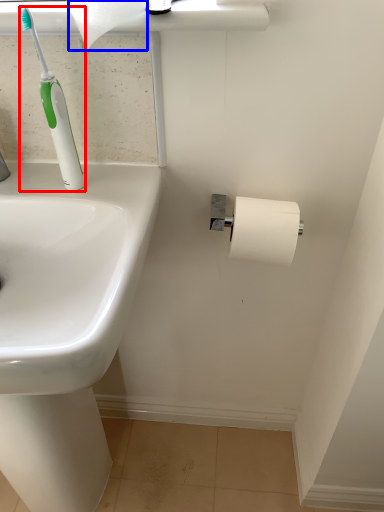
Question: Which of the following is the closest to the observer, toilet brush (highlighted by a red box) or toilet paper (highlighted by a blue box)?

Choices:
 (A) toilet brush
 (B) toilet paper

Answer: (B)